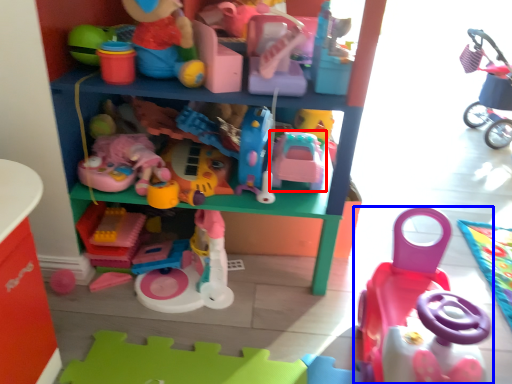
Question: Which object appears farthest to the camera in this image, toy (highlighted by a red box) or toy (highlighted by a blue box)?

Choices:
 (A) toy
 (B) toy

Answer: (A)